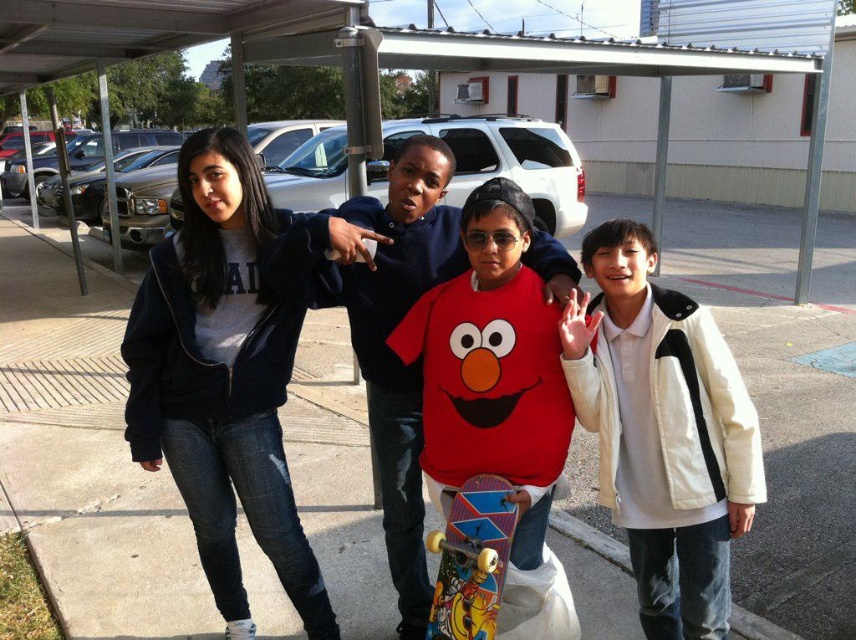
Question: Is dark blue jacket at center behind white cotton jacket at right?

Choices:
 (A) yes
 (B) no

Answer: (A)

Question: Which object is farther from the camera taking this photo?

Choices:
 (A) concrete at center
 (B) white cotton jacket at right
 (C) red matte elmo shirt at center

Answer: (A)

Question: Does concrete at center appear on the left side of multicolored plastic skateboard at center?

Choices:
 (A) no
 (B) yes

Answer: (B)

Question: Does concrete at center appear over white cotton jacket at right?

Choices:
 (A) no
 (B) yes

Answer: (B)

Question: Which is nearer to the multicolored plastic skateboard at center?

Choices:
 (A) dark blue jacket at center
 (B) red matte elmo shirt at center
 (C) concrete at center
 (D) white cotton jacket at right

Answer: (D)

Question: Considering the real-world distances, which object is farthest from the red matte elmo shirt at center?

Choices:
 (A) multicolored plastic skateboard at center
 (B) white cotton jacket at right

Answer: (B)